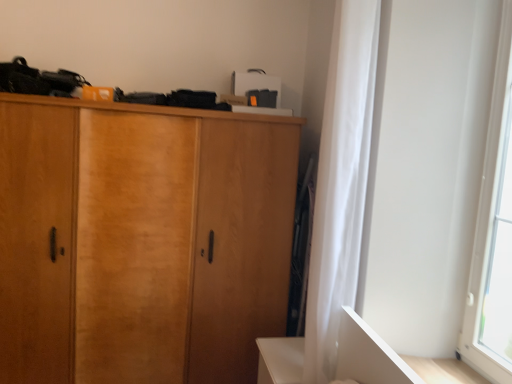
This screenshot has width=512, height=384. Describe the element at coordinates (341, 182) in the screenshot. I see `white sheer curtain at right` at that location.

This screenshot has height=384, width=512. What do you see at coordinates (141, 241) in the screenshot?
I see `wooden cabinet at center` at bounding box center [141, 241].

Describe the element at coordinates (493, 233) in the screenshot. I see `transparent glass window at right` at that location.

Where is `white sheer curtain at right`? The height and width of the screenshot is (384, 512). white sheer curtain at right is located at coordinates (341, 182).

Are transparent glass window at right and wooden cabinet at center making contact?

transparent glass window at right and wooden cabinet at center are not in contact.

Is point (480, 248) positioned behind point (42, 299)?

That is False.

Which of these two, transparent glass window at right or wooden cabinet at center, stands shorter?

Standing shorter between the two is transparent glass window at right.

Is transparent glass window at right surrounding white sheer curtain at right?

That's incorrect, white sheer curtain at right is not inside transparent glass window at right.

In the image, is transparent glass window at right on the left side or the right side of white sheer curtain at right?

In the image, transparent glass window at right appears on the right side of white sheer curtain at right.

Are transparent glass window at right and white sheer curtain at right located far from each other?

No, transparent glass window at right is not far away from white sheer curtain at right.

Find the location of a particular element. This screenshot has width=512, height=384. curtain located behind the transparent glass window at right is located at coordinates (341, 182).

Looking at the image, does wooden cabinet at center seem bigger or smaller compared to transparent glass window at right?

Clearly, wooden cabinet at center is larger in size than transparent glass window at right.

Does wooden cabinet at center have a lesser height compared to transparent glass window at right?

No, wooden cabinet at center is not shorter than transparent glass window at right.

Considering the positions of objects wooden cabinet at center and transparent glass window at right in the image provided, who is in front, wooden cabinet at center or transparent glass window at right?

Positioned in front is transparent glass window at right.

From a real-world perspective, is wooden cabinet at center over transparent glass window at right?

Incorrect, from a real-world perspective, wooden cabinet at center is lower than transparent glass window at right.

From the image's perspective, is white sheer curtain at right located above or below transparent glass window at right?

white sheer curtain at right is situated lower than transparent glass window at right in the image.

From a real-world perspective, between white sheer curtain at right and transparent glass window at right, who is vertically higher?

transparent glass window at right.

Measure the distance from white sheer curtain at right to transparent glass window at right.

white sheer curtain at right is 22.71 inches away from transparent glass window at right.

Considering the relative sizes of white sheer curtain at right and transparent glass window at right in the image provided, is white sheer curtain at right bigger than transparent glass window at right?

Yes.

From the image's perspective, which one is positioned higher, wooden cabinet at center or white sheer curtain at right?

white sheer curtain at right is shown above in the image.

Measure the distance from wooden cabinet at center to white sheer curtain at right.

A distance of 36.12 inches exists between wooden cabinet at center and white sheer curtain at right.

In the image, there is a white sheer curtain at right. Where is `cupboard below it (from a real-world perspective)`? This screenshot has height=384, width=512. cupboard below it (from a real-world perspective) is located at coordinates (141, 241).

Considering the relative sizes of wooden cabinet at center and white sheer curtain at right in the image provided, is wooden cabinet at center smaller than white sheer curtain at right?

Actually, wooden cabinet at center might be larger than white sheer curtain at right.

Which is in front, point (341, 11) or point (119, 233)?

Point (341, 11)

Considering the sizes of objects white sheer curtain at right and wooden cabinet at center in the image provided, who is bigger, white sheer curtain at right or wooden cabinet at center?

With larger size is wooden cabinet at center.

Locate an element on the screen. curtain that appears on the right of wooden cabinet at center is located at coordinates (341, 182).

Locate an element on the screen. This screenshot has height=384, width=512. window screen above the wooden cabinet at center (from a real-world perspective) is located at coordinates (493, 233).

You are a GUI agent. You are given a task and a screenshot of the screen. Output one action in this format:
    pyautogui.click(x=<x>, y=<y>)
    Task: Click on the curtain that appears below the transparent glass window at right (from a real-world perspective)
    The image size is (512, 384).
    Given the screenshot: What is the action you would take?
    pyautogui.click(x=341, y=182)

From the image, which object appears to be farther from white sheer curtain at right, transparent glass window at right or wooden cabinet at center?

Among the two, wooden cabinet at center is located further to white sheer curtain at right.

In the scene shown: When comparing their distances from transparent glass window at right, does white sheer curtain at right or wooden cabinet at center seem further?

Based on the image, wooden cabinet at center appears to be further to transparent glass window at right.

Looking at this image, from the image, which object appears to be nearer to wooden cabinet at center, white sheer curtain at right or transparent glass window at right?

Answer: The object closer to wooden cabinet at center is white sheer curtain at right.

When comparing their distances from white sheer curtain at right, does wooden cabinet at center or transparent glass window at right seem closer?

transparent glass window at right is closer to white sheer curtain at right.

Estimate the real-world distances between objects in this image. Which object is closer to transparent glass window at right, wooden cabinet at center or white sheer curtain at right?

white sheer curtain at right lies closer to transparent glass window at right than the other object.

Estimate the real-world distances between objects in this image. Which object is closer to wooden cabinet at center, transparent glass window at right or white sheer curtain at right?

Based on the image, white sheer curtain at right appears to be nearer to wooden cabinet at center.

You are a GUI agent. You are given a task and a screenshot of the screen. Output one action in this format:
    pyautogui.click(x=<x>, y=<y>)
    Task: Click on the curtain between wooden cabinet at center and transparent glass window at right
    
    Given the screenshot: What is the action you would take?
    pyautogui.click(x=341, y=182)